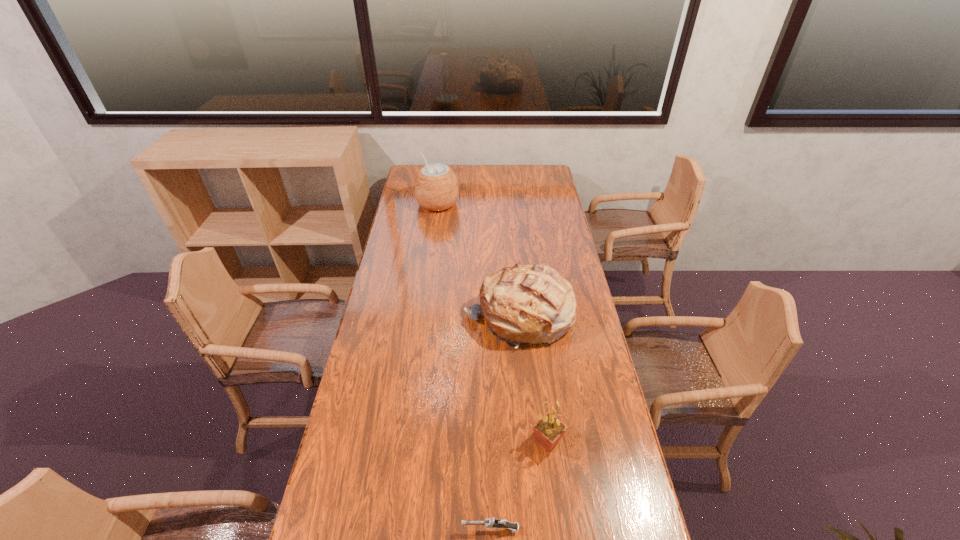
Identify the location of the farthest object. Image resolution: width=960 pixels, height=540 pixels. (436, 188).

You are a GUI agent. You are given a task and a screenshot of the screen. Output one action in this format:
    pyautogui.click(x=<x>, y=<y>)
    Task: Click on the coconut
    
    Given the screenshot: What is the action you would take?
    pyautogui.click(x=436, y=188)

Identify the location of bread. The width and height of the screenshot is (960, 540). (532, 304).

The image size is (960, 540). I want to click on the second tallest object, so click(532, 304).

Image resolution: width=960 pixels, height=540 pixels. In order to click on the second shortest object in this screenshot , I will do `click(548, 431)`.

Locate an element on the screen. the second nearest object is located at coordinates (548, 431).

Find the location of a particular element. gun is located at coordinates (490, 523).

This screenshot has height=540, width=960. What are the coordinates of `the nearest object` in the screenshot? It's located at point(490,523).

Identify the location of vacant region located 0.380m on the right of the coconut. (531, 204).

Locate an element on the screen. free spot located 0.170m on the front of the bread is located at coordinates (525, 393).